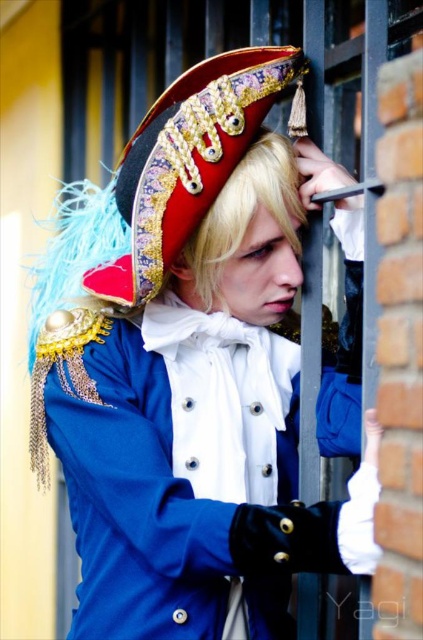
Can you confirm if shiny gold and velvet hat at center is positioned to the right of blonde hair at center?

In fact, shiny gold and velvet hat at center is to the left of blonde hair at center.

Is shiny gold and velvet hat at center bigger than blonde hair at center?

Correct, shiny gold and velvet hat at center is larger in size than blonde hair at center.

Does point (205, 164) lie in front of point (257, 216)?

Yes, it is.

Identify the location of shiny gold and velvet hat at center. This screenshot has height=640, width=423. (186, 161).